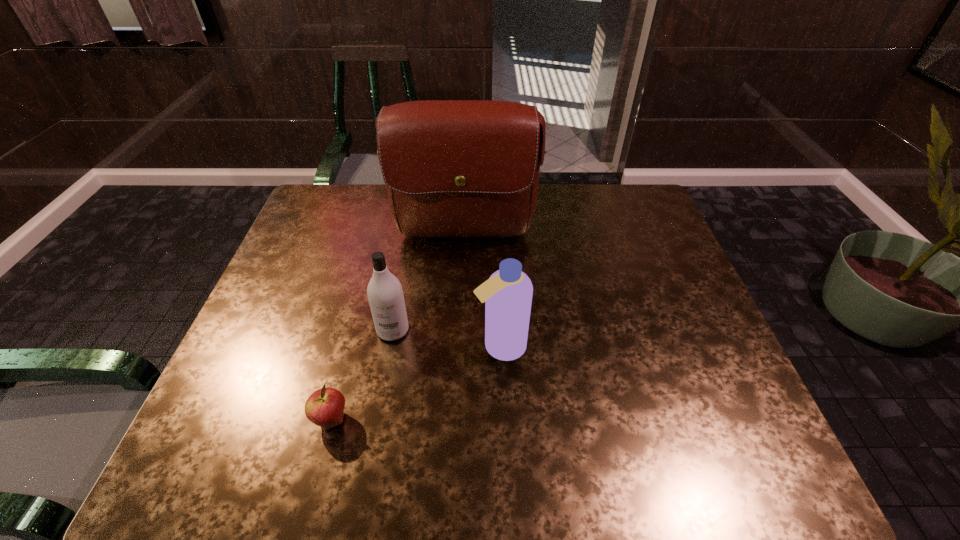
Identify the location of object that is at the far edge. The height and width of the screenshot is (540, 960). pos(453,168).

This screenshot has height=540, width=960. Find the location of `object that is at the near edge`. object that is at the near edge is located at coordinates (325, 407).

Image resolution: width=960 pixels, height=540 pixels. What are the coordinates of `free location at the near edge` in the screenshot? It's located at (476, 450).

Identify the location of blank area at the left edge. The width and height of the screenshot is (960, 540). (327, 249).

You are a GUI agent. You are given a task and a screenshot of the screen. Output one action in this format:
    pyautogui.click(x=<x>, y=<y>)
    Task: Click on the blank space at the right edge of the desktop
    Image resolution: width=960 pixels, height=540 pixels.
    Given the screenshot: What is the action you would take?
    pyautogui.click(x=659, y=244)

The width and height of the screenshot is (960, 540). Find the location of `vacant space at the far left corner of the desktop`. vacant space at the far left corner of the desktop is located at coordinates (344, 208).

In the image, there is a desktop. Where is `vacant area at the far right corner`? vacant area at the far right corner is located at coordinates (640, 192).

Locate an element on the screen. This screenshot has height=540, width=960. vacant space that's between the right shampoo and the left shampoo is located at coordinates (446, 338).

Find the location of `vacant space in between the right shampoo and the apple`. vacant space in between the right shampoo and the apple is located at coordinates (416, 383).

Locate an element on the screen. unoccupied position between the leftmost object and the right shampoo is located at coordinates (416, 383).